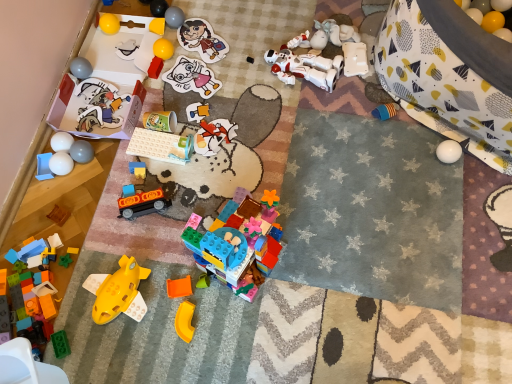
Image resolution: width=512 pixels, height=384 pixels. What do you see at coordinates (355, 59) in the screenshot?
I see `white plastic robot at upper right, the second toy in the right-to-left sequence` at bounding box center [355, 59].

I want to click on black plastic toy at center, which is the 23th toy from left to right, so click(x=250, y=60).

Where is `matte gray ball at lower left, which is counted as the seventh toy, starting from the left`? Image resolution: width=512 pixels, height=384 pixels. matte gray ball at lower left, which is counted as the seventh toy, starting from the left is located at coordinates (81, 151).

At what (x,y) coordinates should I click in order to perform the action: click on rubber yellow toy at center, the twelfth toy when ordered from left to right. Please return your answer as a coordinate pair (x, y). The height and width of the screenshot is (384, 512). Looking at the image, I should click on (138, 170).

Considering the sizes of objects white matte eggs at left, which appears as the 25th toy when viewed from the right, and matte gray ball at upper left, the 5th toy viewed from the left, in the image provided, who is taller, white matte eggs at left, which appears as the 25th toy when viewed from the right, or matte gray ball at upper left, the 5th toy viewed from the left,?

matte gray ball at upper left, the 5th toy viewed from the left, is taller.

From a real-world perspective, between white matte eggs at left, which appears as the 25th toy when viewed from the right, and matte gray ball at upper left, marked as the 22th toy in a right-to-left arrangement, who is vertically higher?

matte gray ball at upper left, marked as the 22th toy in a right-to-left arrangement, from a real-world perspective.

From the image's perspective, is white matte eggs at left, which appears as the 25th toy when viewed from the right, located above matte gray ball at upper left, marked as the 22th toy in a right-to-left arrangement?

No, from the image's perspective, white matte eggs at left, which appears as the 25th toy when viewed from the right, is not above matte gray ball at upper left, marked as the 22th toy in a right-to-left arrangement.

Are white matte eggs at left, which is the second toy from left to right, and matte gray ball at upper left, the 5th toy viewed from the left, far apart?

No, white matte eggs at left, which is the second toy from left to right, is not far away from matte gray ball at upper left, the 5th toy viewed from the left.

Considering the relative sizes of orange matte toy at center, which is counted as the nineteenth toy, starting from the left, and rubber yellow ball at center, the 14th toy positioned from the left, in the image provided, is orange matte toy at center, which is counted as the nineteenth toy, starting from the left, taller than rubber yellow ball at center, the 14th toy positioned from the left,?

Incorrect, the height of orange matte toy at center, which is counted as the nineteenth toy, starting from the left, is not larger of that of rubber yellow ball at center, the 14th toy positioned from the left.

Is point (184, 286) farther from camera compared to point (155, 45)?

No, (184, 286) is in front of (155, 45).

Does orange matte toy at center, which is counted as the nineteenth toy, starting from the left, touch rubber yellow ball at center, the 14th toy positioned from the left?

No, orange matte toy at center, which is counted as the nineteenth toy, starting from the left, is not touching rubber yellow ball at center, the 14th toy positioned from the left.

Can you tell me how much white matte smiley face at upper center, the eleventh toy viewed from the left, and green plastic blocks at lower left, the sixth toy in the left-to-right sequence, differ in facing direction?

20.2 degrees.

Is white matte smiley face at upper center, which is counted as the 16th toy, starting from the right, at the left side of green plastic blocks at lower left, the sixth toy in the left-to-right sequence?

In fact, white matte smiley face at upper center, which is counted as the 16th toy, starting from the right, is to the right of green plastic blocks at lower left, the sixth toy in the left-to-right sequence.

Does point (132, 45) appear closer or farther from the camera than point (65, 264)?

Clearly, point (132, 45) is more distant from the camera than point (65, 264).

Is matte gray ball at upper left, marked as the 22th toy in a right-to-left arrangement, a part of rubber yellow toy at center, marked as the fifteenth toy in a right-to-left arrangement?

No, matte gray ball at upper left, marked as the 22th toy in a right-to-left arrangement, is not a part of rubber yellow toy at center, marked as the fifteenth toy in a right-to-left arrangement.

Which is in front, rubber yellow toy at center, marked as the fifteenth toy in a right-to-left arrangement, or matte gray ball at upper left, the 5th toy viewed from the left?

rubber yellow toy at center, marked as the fifteenth toy in a right-to-left arrangement.

In order to click on the 8th toy behind the rubber yellow toy at center, the twelfth toy when ordered from left to right in this screenshot , I will do `click(81, 68)`.

From a real-world perspective, is rubber yellow toy at center, marked as the fifteenth toy in a right-to-left arrangement, physically located above or below matte gray ball at upper left, the 5th toy viewed from the left?

From a real-world perspective, rubber yellow toy at center, marked as the fifteenth toy in a right-to-left arrangement, is physically below matte gray ball at upper left, the 5th toy viewed from the left.

Which is in front, matte paper sticker at center, the ninth toy from the right, or green matte cup at center, the 12th toy from the right?

green matte cup at center, the 12th toy from the right, is more forward.

How many degrees apart are the facing directions of matte paper sticker at center, the eighteenth toy in the left-to-right sequence, and green matte cup at center, the 12th toy from the right?

There is a 146-degree angle between the facing directions of matte paper sticker at center, the eighteenth toy in the left-to-right sequence, and green matte cup at center, the 12th toy from the right.

Does matte paper sticker at center, the ninth toy from the right, have a lesser width compared to green matte cup at center, the 12th toy from the right?

No, matte paper sticker at center, the ninth toy from the right, is not thinner than green matte cup at center, the 12th toy from the right.

Visually, is rubber yellow toy at center, marked as the fifteenth toy in a right-to-left arrangement, positioned to the left or to the right of matte paper sticker at center, the ninth toy from the right?

Based on their positions, rubber yellow toy at center, marked as the fifteenth toy in a right-to-left arrangement, is located to the left of matte paper sticker at center, the ninth toy from the right.

From the image's perspective, which is above, rubber yellow toy at center, marked as the fifteenth toy in a right-to-left arrangement, or matte paper sticker at center, the ninth toy from the right?

matte paper sticker at center, the ninth toy from the right.

Is rubber yellow toy at center, the twelfth toy when ordered from left to right, facing towards matte paper sticker at center, the ninth toy from the right?

A: No.

From the picture: Could you measure the distance between rubber yellow toy at center, the twelfth toy when ordered from left to right, and matte paper sticker at center, the ninth toy from the right?

rubber yellow toy at center, the twelfth toy when ordered from left to right, and matte paper sticker at center, the ninth toy from the right, are 13.83 inches apart.

Considering the points (189, 311) and (46, 156), which point is behind, point (189, 311) or point (46, 156)?

Positioned behind is point (46, 156).

Between yellow matte plastic toy at lower center, which ranks as the sixth toy in right-to-left order, and blue plastic tray at lower left, positioned as the 26th toy in right-to-left order, which one has more height?

blue plastic tray at lower left, positioned as the 26th toy in right-to-left order, is taller.

From the image's perspective, is yellow matte plastic toy at lower center, which ranks as the sixth toy in right-to-left order, under blue plastic tray at lower left, the first toy in the left-to-right sequence?

Yes.

Is yellow matte plastic toy at lower center, which appears as the 21th toy when viewed from the left, aimed at blue plastic tray at lower left, positioned as the 26th toy in right-to-left order?

No.

Starting from the white matte eggs at left, which is the second toy from left to right, which toy is the 5th one behind? Please provide its 2D coordinates.

[(81, 68)]

Locate an element on the screen. the 5th toy to the right when counting from the rubber yellow ball at center, the 14th toy positioned from the left is located at coordinates (179, 287).

Which object lies further to the anchor point matte gray ball at upper left, the 5th toy viewed from the left, white matte balls at lower left, the 24th toy from the right, or orange plastic toy at center, which is counted as the 22th toy, starting from the left?

Based on the image, orange plastic toy at center, which is counted as the 22th toy, starting from the left, appears to be further to matte gray ball at upper left, the 5th toy viewed from the left.

When comparing their distances from rubber yellow toy at center, marked as the fifteenth toy in a right-to-left arrangement, does green plastic blocks at lower left, the 21th toy when ordered from right to left, or matte paper cutout at upper left, placed as the 17th toy when sorted from right to left, seem closer?

matte paper cutout at upper left, placed as the 17th toy when sorted from right to left, is positioned closer to the anchor rubber yellow toy at center, marked as the fifteenth toy in a right-to-left arrangement.

From the image, which object appears to be nearer to matte gray ball at upper center, positioned as the seventeenth toy in left-to-right order, yellow rubber ball at upper right, which ranks as the 26th toy in left-to-right order, or matte gray ball at upper left, the 5th toy viewed from the left?

Based on the image, matte gray ball at upper left, the 5th toy viewed from the left, appears to be nearer to matte gray ball at upper center, positioned as the seventeenth toy in left-to-right order.

Considering their positions, is yellow rubber ball at upper right, the first toy from the right, positioned further to matte paper sticker at center, the ninth toy from the right, than yellow rubber ball at upper left, positioned as the 9th toy in left-to-right order?

yellow rubber ball at upper right, the first toy from the right, is positioned further to the anchor matte paper sticker at center, the ninth toy from the right.

Based on their spatial positions, is blue plastic tray at lower left, positioned as the 26th toy in right-to-left order, or matte paper cutout at upper left, placed as the 17th toy when sorted from right to left, further from matte gray ball at upper left, the 5th toy viewed from the left?

blue plastic tray at lower left, positioned as the 26th toy in right-to-left order.

Looking at this image, which object lies further to the anchor point rubber yellow ball at center, which ranks as the thirteenth toy in right-to-left order, wooden block at lower left, placed as the 23th toy when sorted from right to left, or matte paper sticker at center, the ninth toy from the right?

The object further to rubber yellow ball at center, which ranks as the thirteenth toy in right-to-left order, is wooden block at lower left, placed as the 23th toy when sorted from right to left.

Based on their spatial positions, is matte gray ball at upper center, which ranks as the 10th toy in right-to-left order, or yellow matte plastic toy at lower center, which appears as the 21th toy when viewed from the left, further from matte paper sticker at center, the eighteenth toy in the left-to-right sequence?

yellow matte plastic toy at lower center, which appears as the 21th toy when viewed from the left, is further to matte paper sticker at center, the eighteenth toy in the left-to-right sequence.

Which object lies nearer to the anchor point white plastic robot at upper right, the 25th toy in the left-to-right sequence, white matte robot at upper center, marked as the 24th toy in a left-to-right arrangement, or rubber yellow ball at center, the 14th toy positioned from the left?

white matte robot at upper center, marked as the 24th toy in a left-to-right arrangement, lies closer to white plastic robot at upper right, the 25th toy in the left-to-right sequence, than the other object.

Image resolution: width=512 pixels, height=384 pixels. Find the location of `toy between black plastic toy at center, which is the 23th toy from left to right, and white plastic robot at upper right, the second toy in the right-to-left sequence, from left to right`. toy between black plastic toy at center, which is the 23th toy from left to right, and white plastic robot at upper right, the second toy in the right-to-left sequence, from left to right is located at coordinates (320, 56).

This screenshot has height=384, width=512. Find the location of `toy between orange plastic toy at center, acting as the fifth toy starting from the right, and yellow matte plastic toy at lower center, which ranks as the sixth toy in right-to-left order, from top to bottom`. toy between orange plastic toy at center, acting as the fifth toy starting from the right, and yellow matte plastic toy at lower center, which ranks as the sixth toy in right-to-left order, from top to bottom is located at coordinates (179, 287).

You are a GUI agent. You are given a task and a screenshot of the screen. Output one action in this format:
    pyautogui.click(x=<x>, y=<y>)
    Task: Click on the toy between wooden block at lower left, which appears as the fourth toy when viewed from the left, and green plastic blocks at lower left, the sixth toy in the left-to-right sequence, in the vertical direction
    
    Given the screenshot: What is the action you would take?
    pyautogui.click(x=72, y=250)

The width and height of the screenshot is (512, 384). I want to click on toy between white matte robot at upper center, placed as the 3th toy when sorted from right to left, and yellow rubber ball at upper right, the first toy from the right, in the horizontal direction, so click(x=355, y=59).